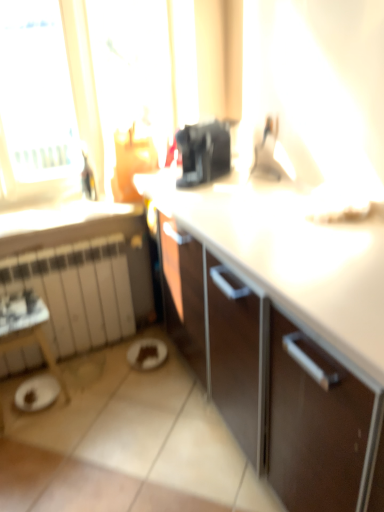
Where is `vacant space situated on the left part of brown matte plate at lower center`? This screenshot has height=512, width=384. vacant space situated on the left part of brown matte plate at lower center is located at coordinates (104, 359).